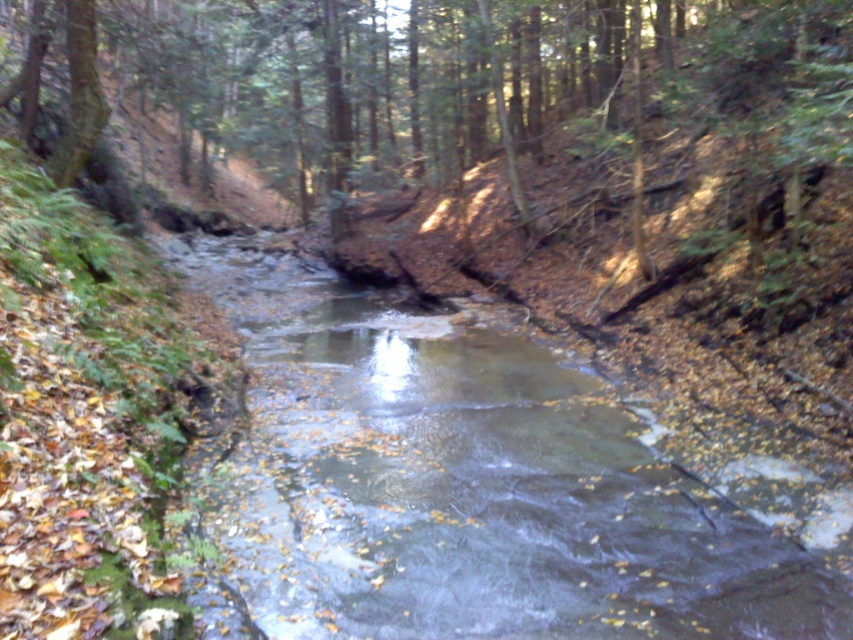
Does clear water at center have a greater height compared to brown wood tree at center?

No.

Can you confirm if clear water at center is positioned below brown wood tree at center?

Yes, clear water at center is below brown wood tree at center.

Between point (410, 442) and point (282, 99), which one is positioned in front?

Point (410, 442)

Where is `clear water at center`? This screenshot has width=853, height=640. clear water at center is located at coordinates (473, 486).